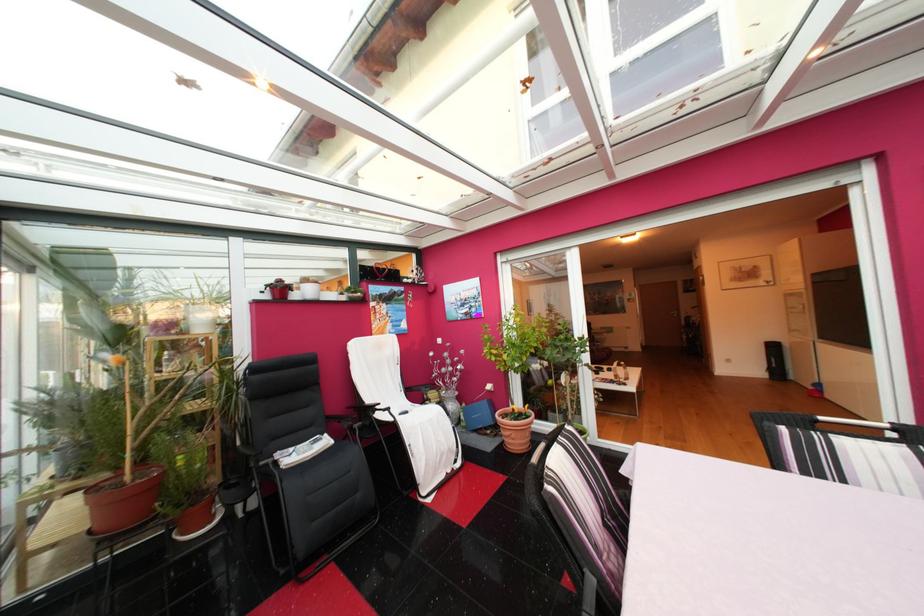
Locate an element on the screen. Image resolution: width=924 pixels, height=616 pixels. folded newspaper is located at coordinates (302, 451).